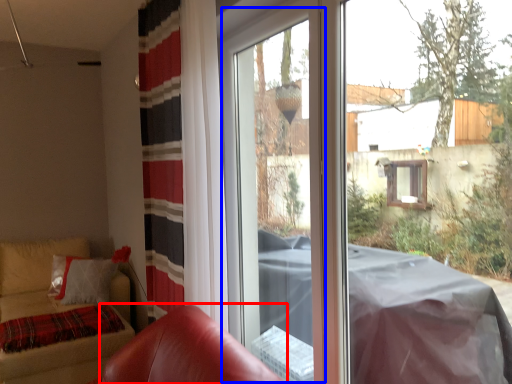
Question: Among these objects, which one is nearest to the camera, armchair (highlighted by a red box) or screen door (highlighted by a blue box)?

Choices:
 (A) armchair
 (B) screen door

Answer: (A)